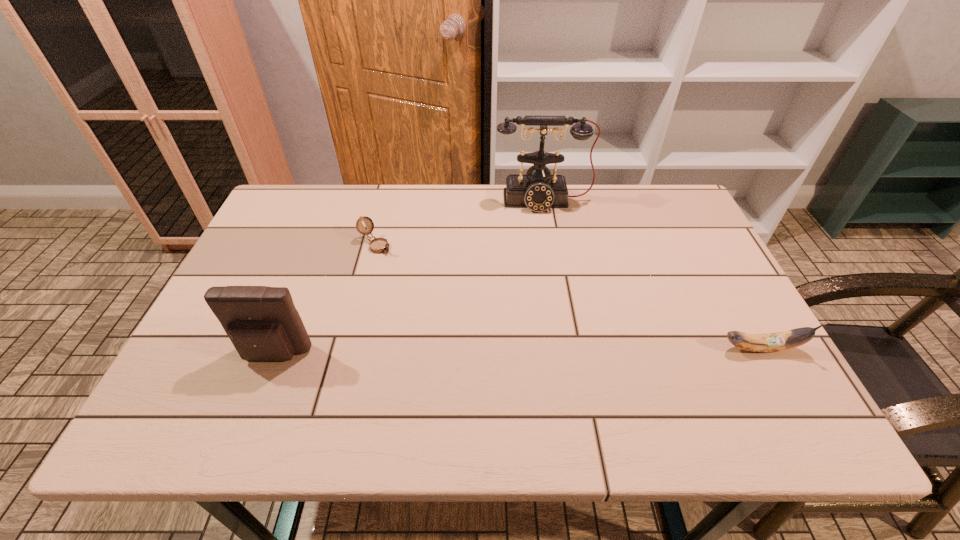
The height and width of the screenshot is (540, 960). In the image, there is a desktop. Find the location of `free space at the near edge`. free space at the near edge is located at coordinates (322, 359).

In the image, there is a desktop. At what (x,y) coordinates should I click in order to perform the action: click on vacant space at the left edge. Please return your answer as a coordinate pair (x, y). The height and width of the screenshot is (540, 960). Looking at the image, I should click on (276, 254).

Locate an element on the screen. free space at the right edge of the desktop is located at coordinates (691, 302).

Identify the location of free region at the far left corner of the desktop. The height and width of the screenshot is (540, 960). (328, 199).

I want to click on vacant space at the far right corner of the desktop, so click(658, 226).

Where is `free area in between the banana and the leftmost object`? The width and height of the screenshot is (960, 540). free area in between the banana and the leftmost object is located at coordinates (517, 352).

Find the location of `free space between the second farthest object and the farthest object`. free space between the second farthest object and the farthest object is located at coordinates (460, 223).

You are a GUI agent. You are given a task and a screenshot of the screen. Output one action in this format:
    pyautogui.click(x=<x>, y=<y>)
    Task: Click on the unoccupied area between the second tallest object and the third tallest object
    This screenshot has height=540, width=960.
    Given the screenshot: What is the action you would take?
    pyautogui.click(x=517, y=352)

Where is `free space that is in between the rightmost object and the farthest object`? This screenshot has height=540, width=960. free space that is in between the rightmost object and the farthest object is located at coordinates (652, 275).

This screenshot has width=960, height=540. I want to click on free spot between the second shortest object and the compass, so click(568, 296).